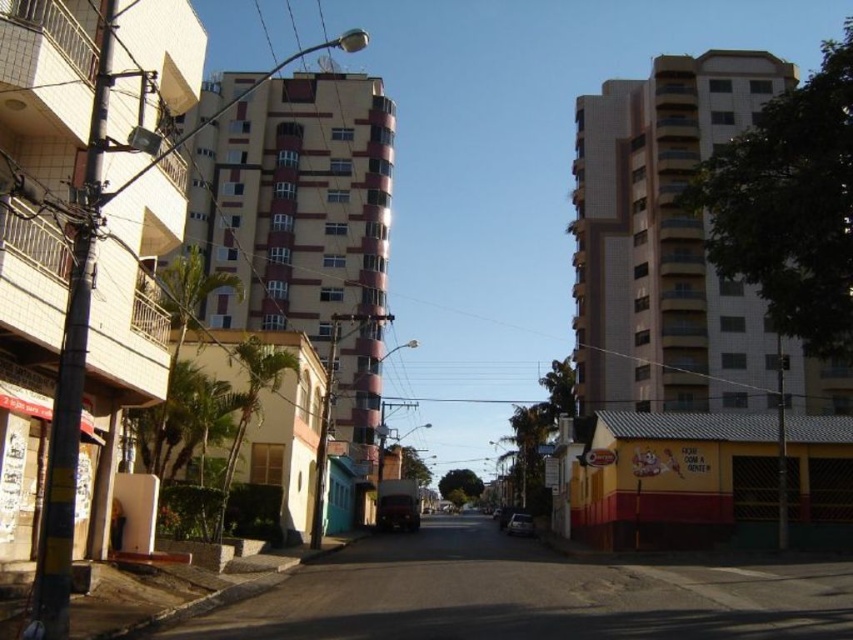
You are a delivery driver who needs to park your vehicle between the shiny black car at center and the metallic silver car at center. Given that your delivery van is 5 meters long, can you fit it in the space between them?

The shiny black car at center is to the left of the metallic silver car at center. However, the distance between them is not provided in the Objects Description, so it is impossible to determine if the 5 meter long van can fit between them.

You are driving a shiny black car at center and want to park it on the smooth concrete road at center. Is there enough space for your car to fit on the road?

The smooth concrete road at center might be wider than shiny black car at center, so there is likely enough space for the car to fit.